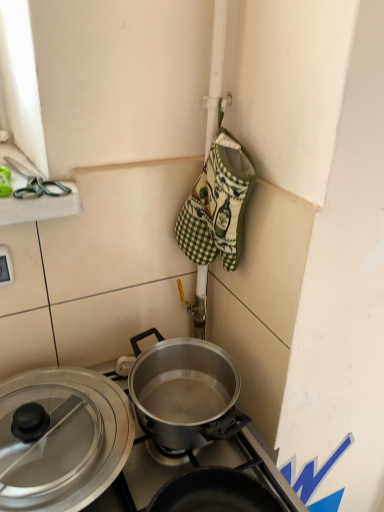
Question: Is transparent glass lid at lower left bigger than polished silver pot at center?

Choices:
 (A) yes
 (B) no

Answer: (B)

Question: Does transparent glass lid at lower left have a lesser width compared to polished silver pot at center?

Choices:
 (A) no
 (B) yes

Answer: (A)

Question: Considering the relative positions of transparent glass lid at lower left and polished silver pot at center in the image provided, is transparent glass lid at lower left in front of polished silver pot at center?

Choices:
 (A) yes
 (B) no

Answer: (A)

Question: Can you confirm if transparent glass lid at lower left is wider than polished silver pot at center?

Choices:
 (A) no
 (B) yes

Answer: (B)

Question: Is transparent glass lid at lower left taller than polished silver pot at center?

Choices:
 (A) no
 (B) yes

Answer: (A)

Question: Is transparent glass lid at lower left facing away from polished silver pot at center?

Choices:
 (A) no
 (B) yes

Answer: (A)

Question: Is transparent glass lid at lower left behind white plastic electric outlet at lower left?

Choices:
 (A) no
 (B) yes

Answer: (A)

Question: From a real-world perspective, is transparent glass lid at lower left located higher than white plastic electric outlet at lower left?

Choices:
 (A) yes
 (B) no

Answer: (B)

Question: Is transparent glass lid at lower left facing towards white plastic electric outlet at lower left?

Choices:
 (A) no
 (B) yes

Answer: (A)

Question: Can you confirm if transparent glass lid at lower left is thinner than white plastic electric outlet at lower left?

Choices:
 (A) yes
 (B) no

Answer: (B)

Question: Considering the relative sizes of transparent glass lid at lower left and white plastic electric outlet at lower left in the image provided, is transparent glass lid at lower left taller than white plastic electric outlet at lower left?

Choices:
 (A) yes
 (B) no

Answer: (A)

Question: From the image's perspective, is transparent glass lid at lower left under white plastic electric outlet at lower left?

Choices:
 (A) yes
 (B) no

Answer: (A)

Question: Considering the relative sizes of green checkered oven mitt at center and white plastic electric outlet at lower left in the image provided, is green checkered oven mitt at center thinner than white plastic electric outlet at lower left?

Choices:
 (A) yes
 (B) no

Answer: (B)